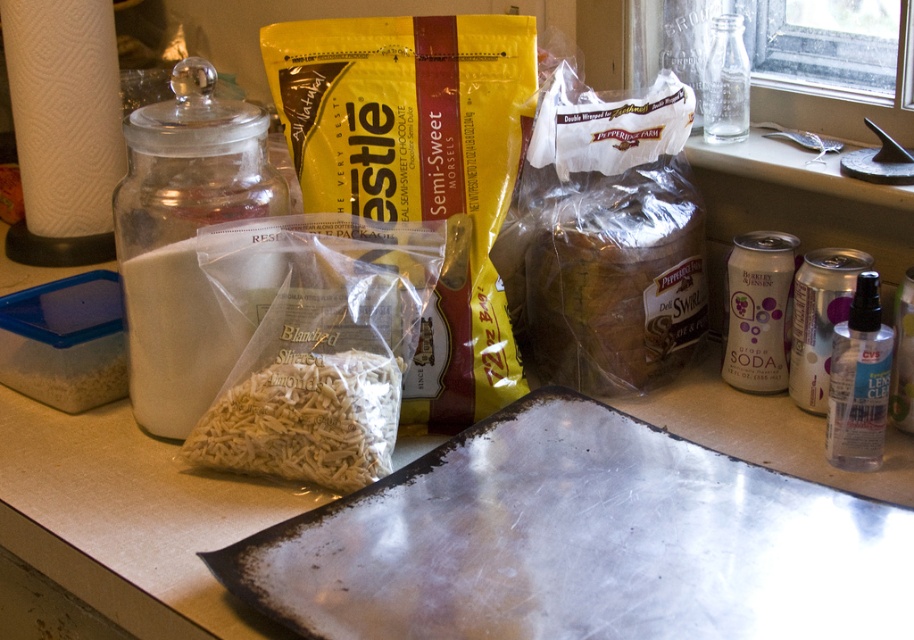
From the picture: You are a chef preparing a dish and need to place the white textured shredded mozzarella at center onto the metallic silver baking sheet at lower center. Given that the mozzarella is currently 7.75 inches away, can you estimate whether you can reach it without moving your position?

The white textured shredded mozzarella at center is 7.75 inches away from the metallic silver baking sheet at lower center. Whether you can reach it depends on your arm length, but the distance is about the length of a standard ruler. If your arm can extend that far, you can reach it without moving.

You are a chef trying to clean the kitchen countertop. You see the metallic silver baking sheet at lower center and the white powder at left. Which object is located above the other?

The metallic silver baking sheet at lower center is positioned under the white powder at left, meaning the white powder at left is above it.

You are a chef preparing to bake cookies. You need to measure the distance between the metallic silver baking sheet at lower center and the white powder at left to ensure your mixing bowl will fit between them. The bowl is 12 inches in diameter. Will it fit?

The metallic silver baking sheet at lower center and white powder at left are 14.11 inches apart from each other. Since the mixing bowl is 12 inches in diameter, it will fit between them as the space is wider than the bowl.